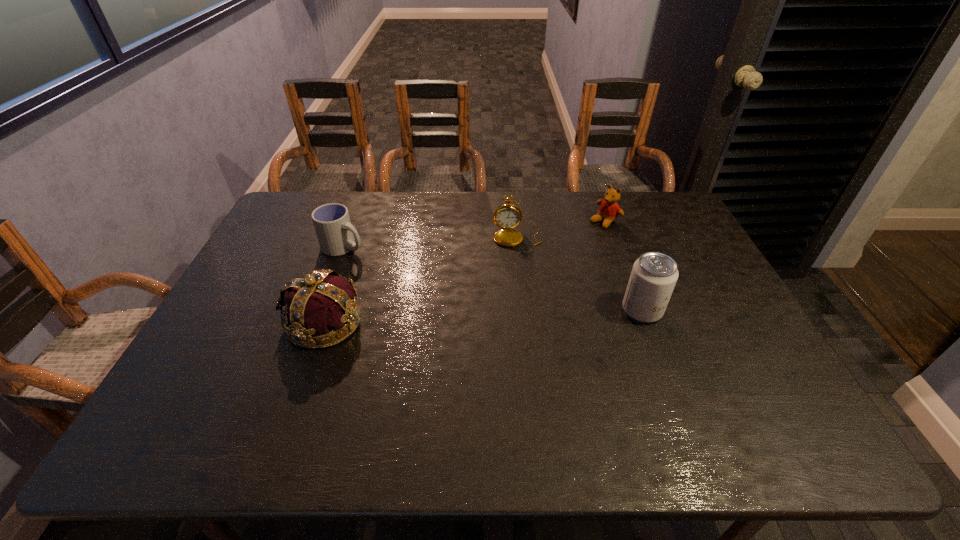
Locate an element on the screen. The height and width of the screenshot is (540, 960). crown is located at coordinates (320, 310).

Identify the location of soda can. (654, 275).

Locate an element on the screen. pocket watch is located at coordinates pos(507,216).

Find the location of a particular element. This screenshot has height=540, width=960. cup is located at coordinates (335, 233).

This screenshot has width=960, height=540. Identify the location of teddy bear. (609, 210).

Identify the location of free space located 0.390m on the back of the crown. The width and height of the screenshot is (960, 540). (362, 217).

The width and height of the screenshot is (960, 540). Identify the location of free space located on the front of the soda can. (678, 405).

In order to click on vacant area situated 0.150m on the face of the pocket watch in this screenshot , I will do `click(525, 279)`.

Identify the location of vacant region located on the face of the pocket watch. The height and width of the screenshot is (540, 960). (538, 345).

The height and width of the screenshot is (540, 960). Find the location of `vacant space located on the face of the pocket watch`. vacant space located on the face of the pocket watch is located at coordinates (536, 335).